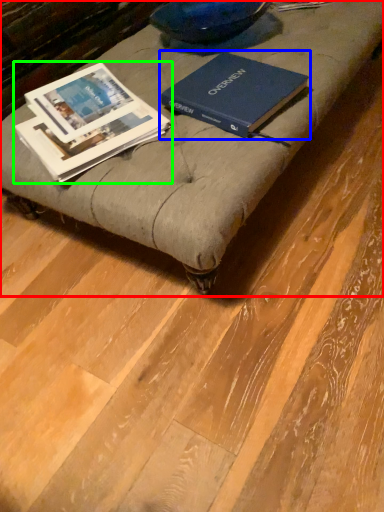
Question: Estimate the real-world distances between objects in this image. Which object is closer to furniture (highlighted by a red box), book (highlighted by a blue box) or book (highlighted by a green box)?

Choices:
 (A) book
 (B) book

Answer: (A)